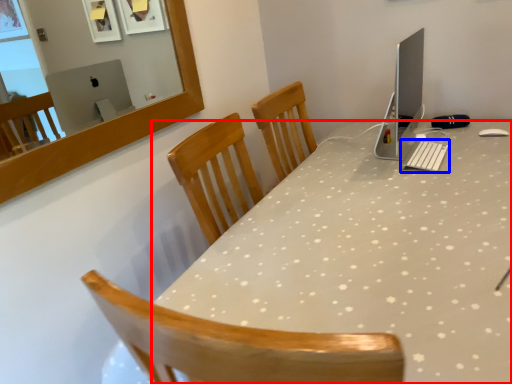
Question: Which object appears farthest to the camera in this image, desk (highlighted by a red box) or keyboard (highlighted by a blue box)?

Choices:
 (A) desk
 (B) keyboard

Answer: (B)